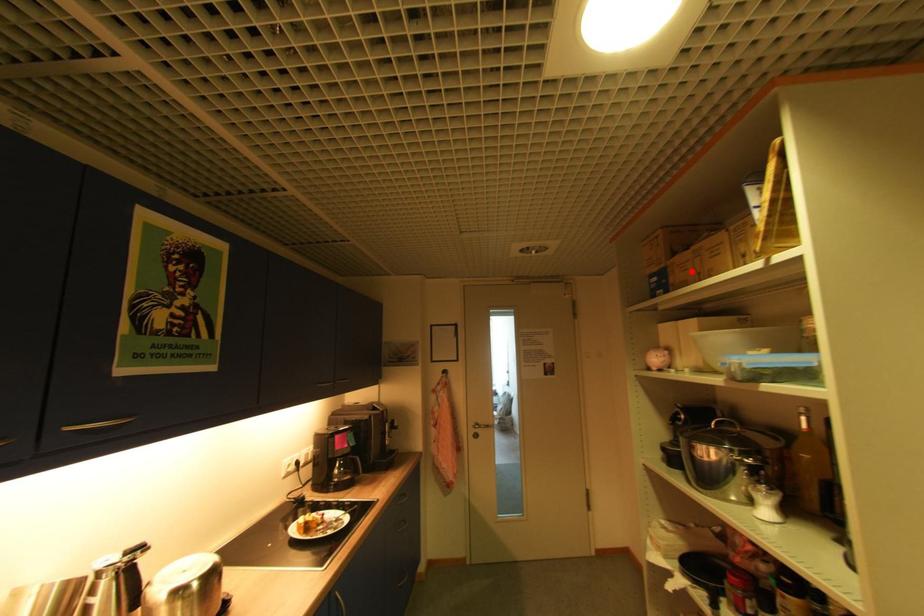
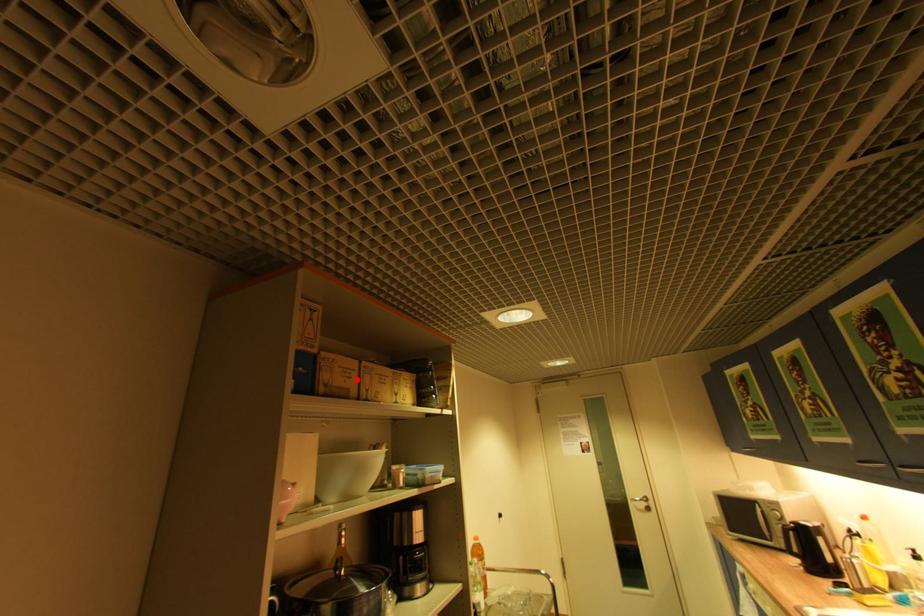
I am providing you with two images of the same scene from different viewpoints. A red point is marked on the first image and another point is marked on the second image. Is the marked point in image1 the same physical position as the marked point in image2?

Yes